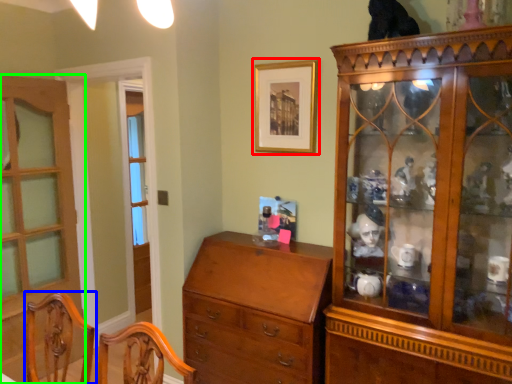
Question: Which object is the closest to the picture frame (highlighted by a red box)? Choose among these: chair (highlighted by a blue box) or door (highlighted by a green box).

Choices:
 (A) chair
 (B) door

Answer: (A)